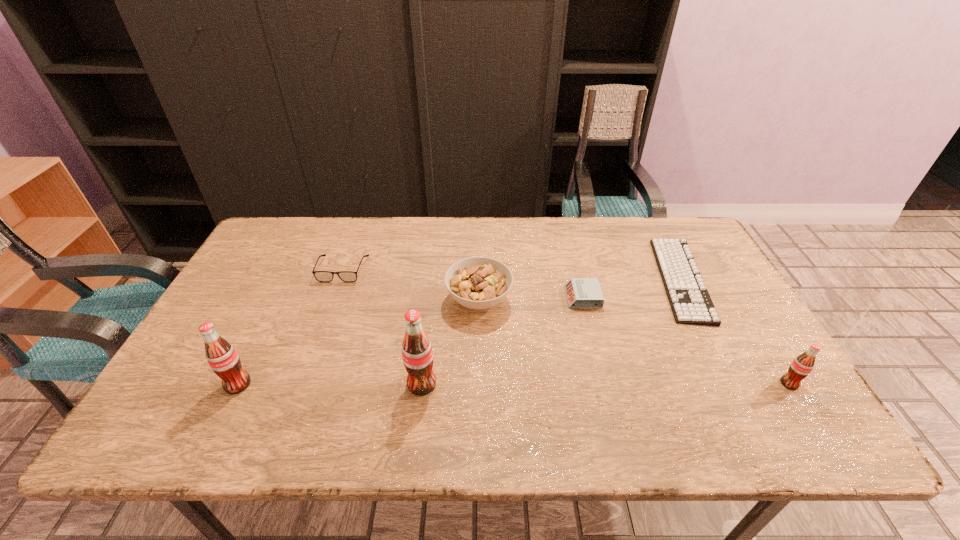
This screenshot has height=540, width=960. I want to click on spectacles located in the far edge section of the desktop, so click(x=322, y=276).

Find the location of a particular element. Image resolution: width=960 pixels, height=540 pixels. computer keyboard at the far edge is located at coordinates (690, 302).

Image resolution: width=960 pixels, height=540 pixels. I want to click on object that is at the left edge, so click(223, 359).

Where is `soda at the right edge`? The image size is (960, 540). soda at the right edge is located at coordinates (800, 368).

I want to click on computer keyboard at the right edge, so click(690, 302).

What are the coordinates of `object at the near left corner` in the screenshot? It's located at (223, 359).

At what (x,y) coordinates should I click in order to perform the action: click on object located at the far right corner. Please return your answer as a coordinate pair (x, y). Looking at the image, I should click on (690, 302).

Where is `object that is at the near right corner`? object that is at the near right corner is located at coordinates (800, 368).

Image resolution: width=960 pixels, height=540 pixels. Find the location of `free space at the far edge`. free space at the far edge is located at coordinates (568, 243).

In the image, there is a desktop. Where is `vacant space at the near edge`? Image resolution: width=960 pixels, height=540 pixels. vacant space at the near edge is located at coordinates (592, 400).